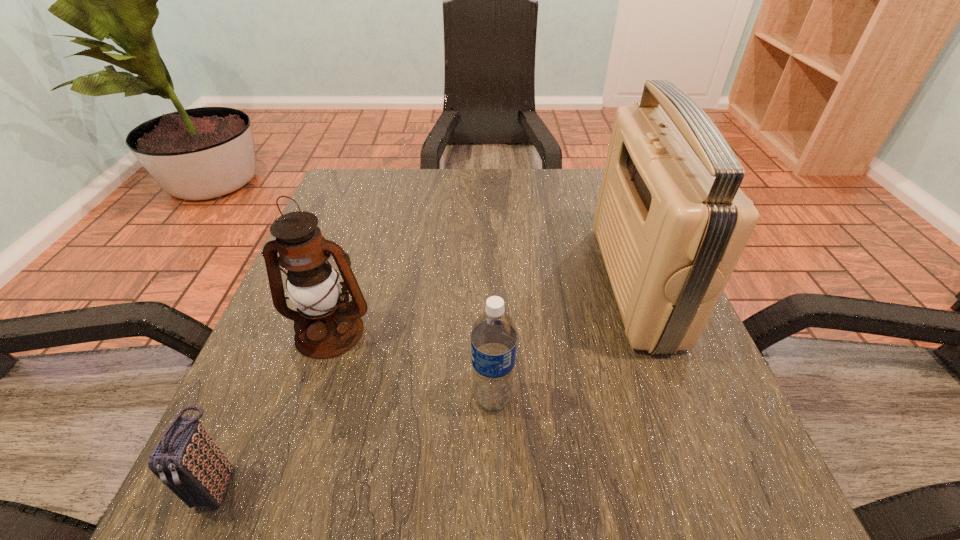
The width and height of the screenshot is (960, 540). In order to click on free point between the rightmost object and the shortest object in this screenshot , I will do `click(426, 383)`.

This screenshot has height=540, width=960. Identify the location of free space between the lantern and the second object from right to left. (411, 365).

Where is `free area in between the rightmost object and the third farthest object`? free area in between the rightmost object and the third farthest object is located at coordinates (564, 340).

Image resolution: width=960 pixels, height=540 pixels. Identify the location of the closest object to the clutch bag. (313, 286).

This screenshot has width=960, height=540. In order to click on object that stands as the second closest to the water bottle in this screenshot , I will do `click(671, 222)`.

Where is `vacant space that satisfies the following two spatial constraints: 1. on the front-facing side of the tallest object; 2. on the side of the second tallest object, there is a wick adjustment knob`? The width and height of the screenshot is (960, 540). vacant space that satisfies the following two spatial constraints: 1. on the front-facing side of the tallest object; 2. on the side of the second tallest object, there is a wick adjustment knob is located at coordinates (654, 332).

Locate an element on the screen. This screenshot has height=540, width=960. free space that satisfies the following two spatial constraints: 1. on the front-facing side of the tallest object; 2. on the side of the lantern, there is a wick adjustment knob is located at coordinates (654, 332).

Find the location of `vacant space that satisfies the following two spatial constraints: 1. on the front-facing side of the rightmost object; 2. on the side of the second tallest object, there is a wick adjustment knob`. vacant space that satisfies the following two spatial constraints: 1. on the front-facing side of the rightmost object; 2. on the side of the second tallest object, there is a wick adjustment knob is located at coordinates (654, 332).

Image resolution: width=960 pixels, height=540 pixels. Find the location of `vacant space that satisfies the following two spatial constraints: 1. on the front-facing side of the rightmost object; 2. with the zip open on the clutch bag`. vacant space that satisfies the following two spatial constraints: 1. on the front-facing side of the rightmost object; 2. with the zip open on the clutch bag is located at coordinates (712, 484).

You are a GUI agent. You are given a task and a screenshot of the screen. Output one action in this format:
    pyautogui.click(x=<x>, y=<y>)
    Task: Click on the free space that satisfies the following two spatial constraints: 1. on the front-facing side of the rightmost object; 2. with the zip open on the shortest object
    
    Given the screenshot: What is the action you would take?
    pyautogui.click(x=712, y=484)